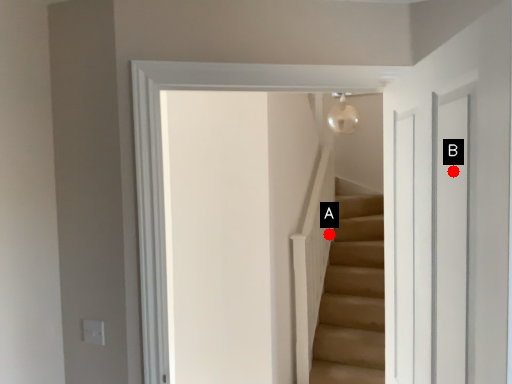
Question: Two points are circled on the image, labeled by A and B beside each circle. Which point appears closest to the camera in this image?

Choices:
 (A) A is closer
 (B) B is closer

Answer: (B)